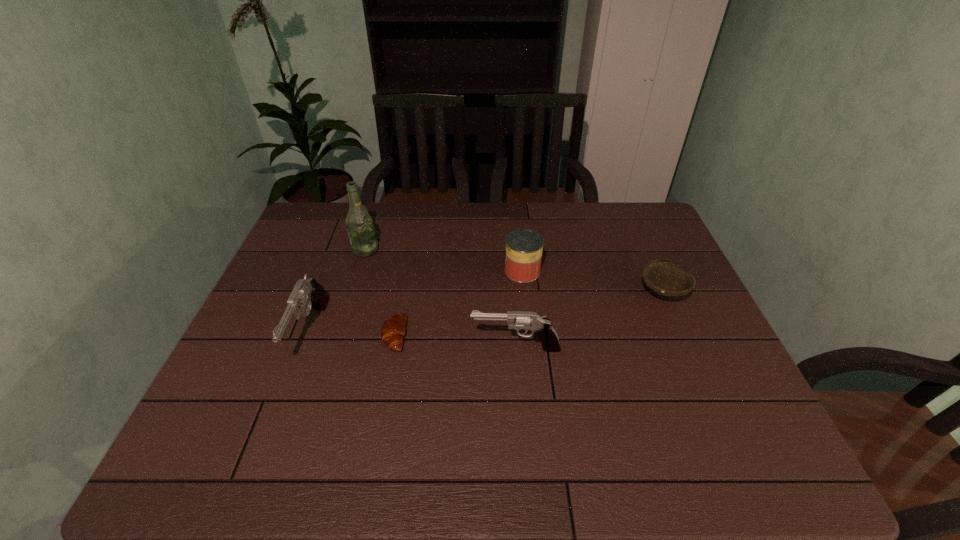
You are a GUI agent. You are given a task and a screenshot of the screen. Output one action in this format:
    pyautogui.click(x=<x>, y=<y>)
    Task: Click on the object located in the right edge section of the desktop
    The image size is (960, 540).
    Given the screenshot: What is the action you would take?
    pyautogui.click(x=662, y=278)

In the image, there is a desktop. Find the location of `vacant space at the far edge`. vacant space at the far edge is located at coordinates (532, 230).

The height and width of the screenshot is (540, 960). In order to click on blank space at the near edge in this screenshot , I will do `click(410, 393)`.

In the image, there is a desktop. Where is `vacant space at the left edge`? Image resolution: width=960 pixels, height=540 pixels. vacant space at the left edge is located at coordinates (304, 256).

Identify the location of vacant space at the right edge of the desktop. (731, 373).

In the image, there is a desktop. Where is `free region at the far left corner`? free region at the far left corner is located at coordinates (315, 216).

The image size is (960, 540). Identify the location of vacant region at the far right corner. (621, 215).

At what (x,y) coordinates should I click in order to perform the action: click on free space between the shorter gun and the leftmost object. Please return your answer as a coordinate pair (x, y). This screenshot has width=960, height=540. Looking at the image, I should click on (413, 341).

Locate an element on the screen. The width and height of the screenshot is (960, 540). free space that is in between the shortest object and the can is located at coordinates (459, 303).

The height and width of the screenshot is (540, 960). Find the location of `blank region between the can and the shorter gun`. blank region between the can and the shorter gun is located at coordinates (519, 309).